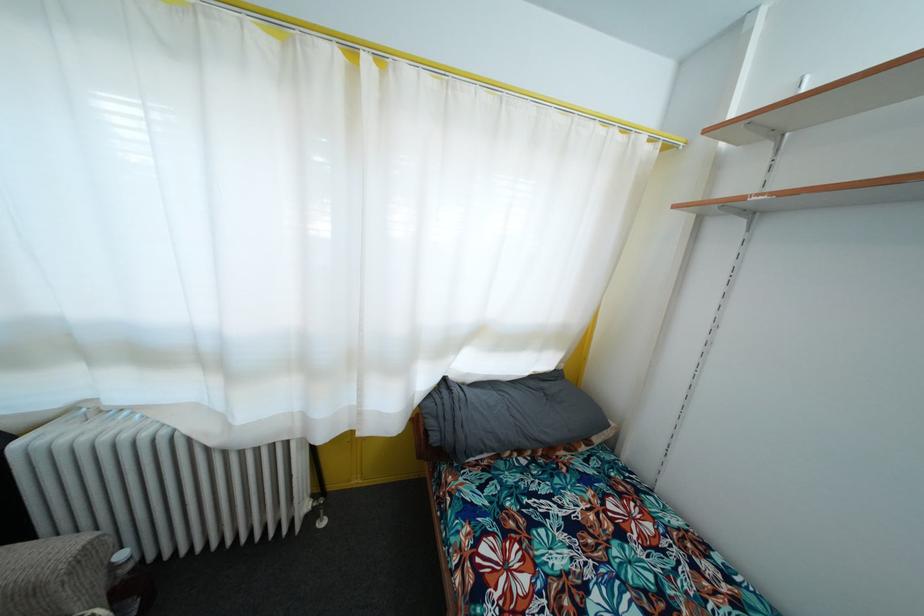
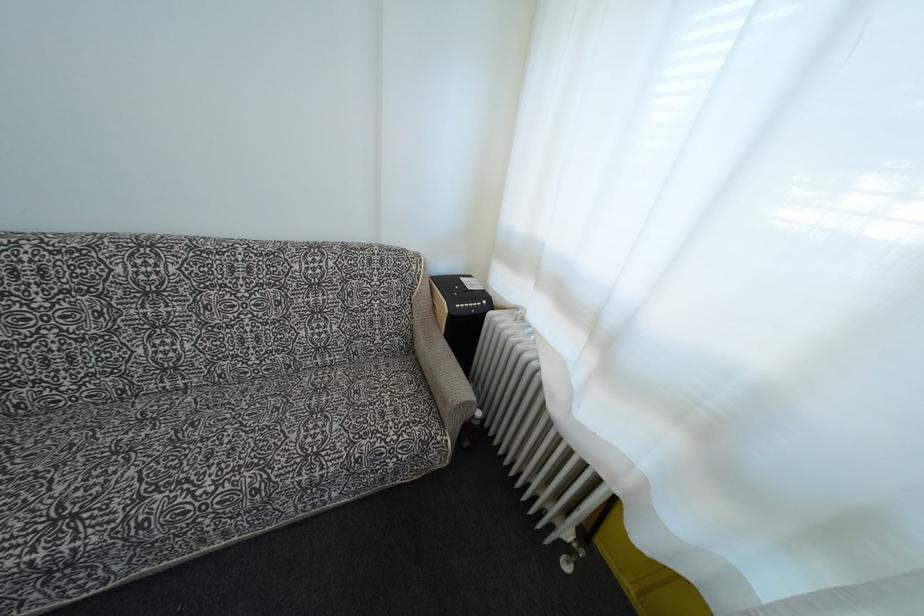
How did the camera likely rotate?

The rotation direction of the camera is left-down.